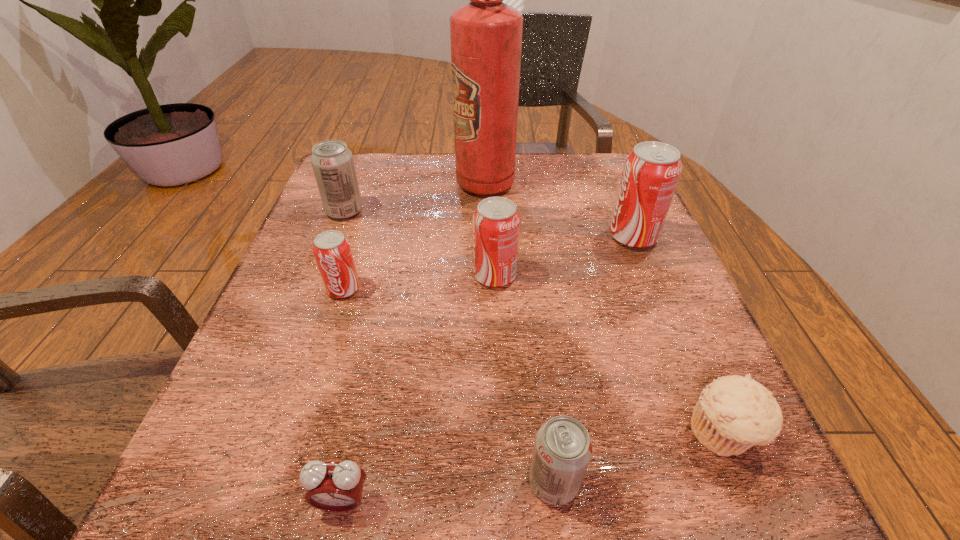
In order to click on the farthest object in this screenshot , I will do `click(486, 34)`.

Where is `fire extinguisher`? This screenshot has height=540, width=960. fire extinguisher is located at coordinates (486, 34).

Locate an element on the screen. The image size is (960, 540). the tallest soda can is located at coordinates (651, 172).

Identify the location of the seventh shortest object. (651, 172).

The width and height of the screenshot is (960, 540). Find the location of `the bigger gray soda can`. the bigger gray soda can is located at coordinates (332, 162).

Locate an element on the screen. This screenshot has width=960, height=540. the farthest soda can is located at coordinates (332, 162).

Find the location of a particular element. the second red soda can from right to left is located at coordinates (496, 222).

You are a GUI agent. You are given a task and a screenshot of the screen. Output one action in this format:
    pyautogui.click(x=<x>, y=<y>)
    Task: Click on the leftmost red soda can
    The width and height of the screenshot is (960, 540).
    Given the screenshot: What is the action you would take?
    pyautogui.click(x=331, y=249)

I want to click on the smaller gray soda can, so click(563, 448).

Locate an element on the screen. the nearer gray soda can is located at coordinates (563, 448).